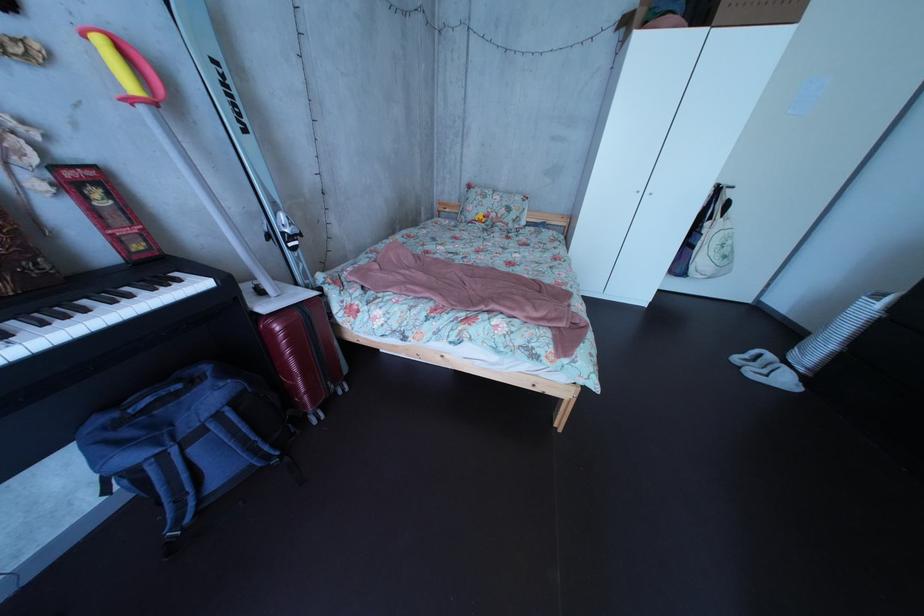
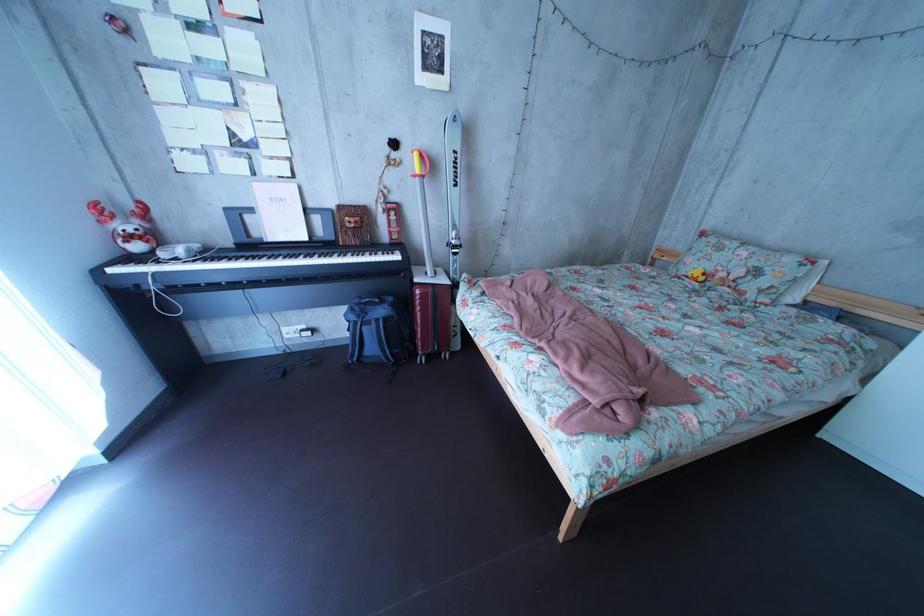
Find the pixel in the second image that matches (499,209) in the first image.

(731, 262)